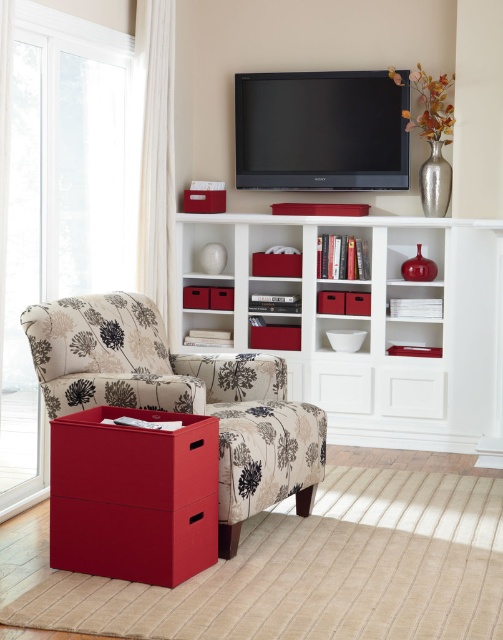
Question: Among these objects, which one is nearest to the camera?

Choices:
 (A) transparent glass door at left
 (B) white matte bookshelf at center
 (C) floral fabric armchair at left
 (D) flat screen tv at upper center

Answer: (C)

Question: Which point is farther from the camera taking this photo?

Choices:
 (A) click(341, 396)
 (B) click(337, 128)
 (C) click(81, 396)
 (D) click(129, 140)

Answer: (B)

Question: Does transparent glass door at left appear on the right side of matte fabric drawer at lower left?

Choices:
 (A) yes
 (B) no

Answer: (B)

Question: Which point appears farthest from the camera in this image?

Choices:
 (A) (175, 496)
 (B) (231, 225)
 (C) (147, 346)
 (D) (365, 163)

Answer: (B)

Question: Does flat screen tv at upper center appear over matte fabric drawer at lower left?

Choices:
 (A) no
 (B) yes

Answer: (B)

Question: Does white matte bookshelf at center have a smaller size compared to transparent glass door at left?

Choices:
 (A) yes
 (B) no

Answer: (A)